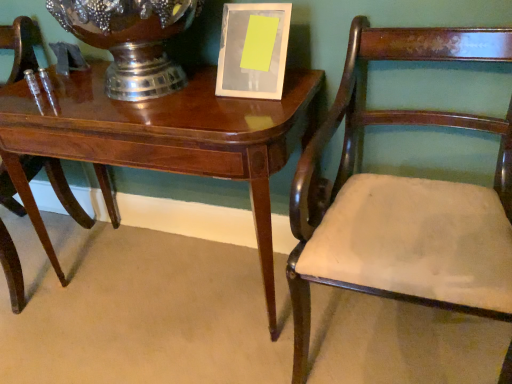
I want to click on vacant space underneath glossy wood table at center (from a real-world perspective), so click(181, 276).